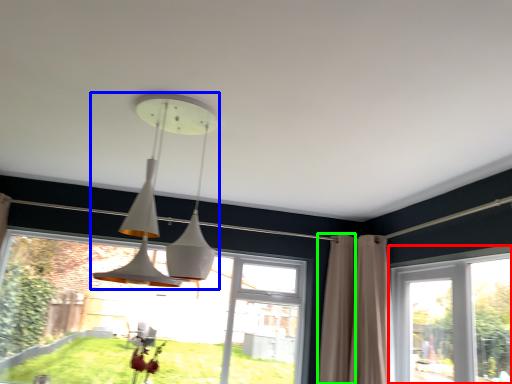
Question: Considering the real-world distances, which object is farthest from window (highlighted by a red box)? lamp (highlighted by a blue box) or curtain (highlighted by a green box)?

Choices:
 (A) lamp
 (B) curtain

Answer: (A)